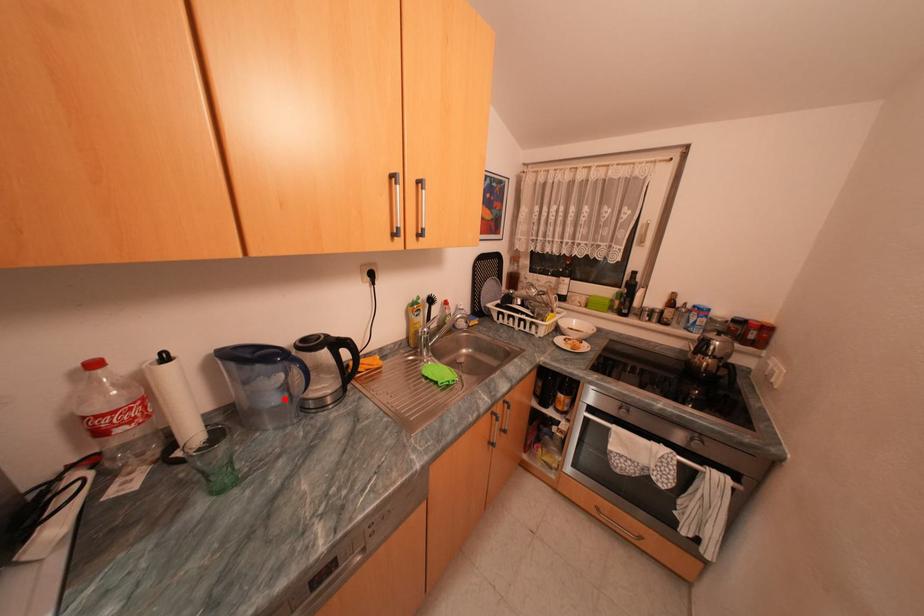
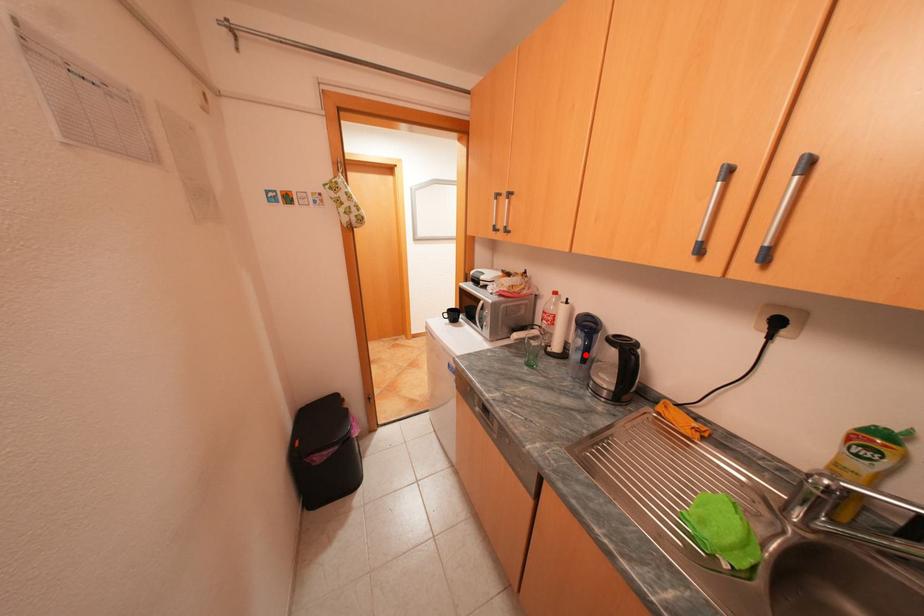
I am providing you with two images of the same scene from different viewpoints. A red point is marked on the first image and another point is marked on the second image. Are the points marked in image1 and image2 representing the same 3D position?

Yes